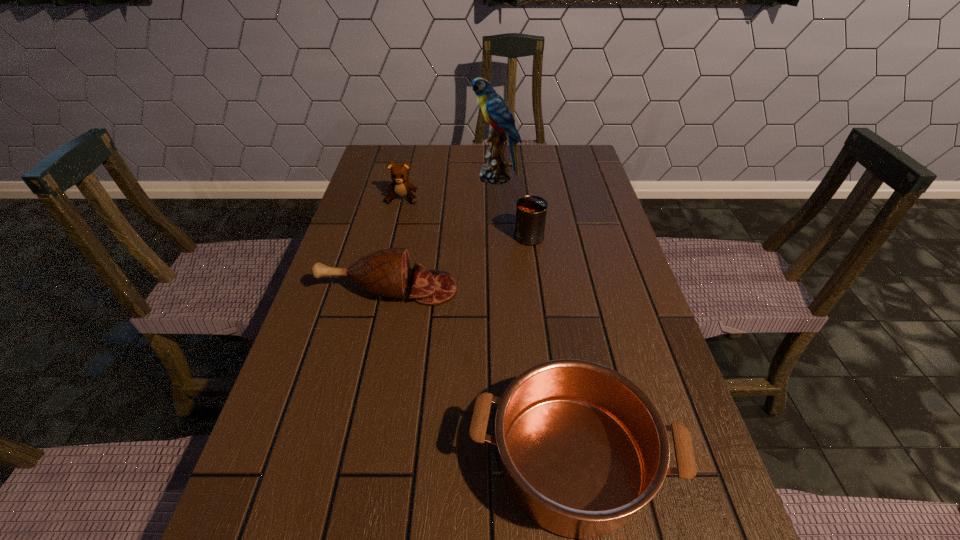
You are a GUI agent. You are given a task and a screenshot of the screen. Output one action in this format:
    pyautogui.click(x=<x>, y=<y>)
    Task: Click on the free space between the tallest object and the fourth nearest object
    
    Given the screenshot: What is the action you would take?
    pyautogui.click(x=449, y=188)

The height and width of the screenshot is (540, 960). In order to click on free space between the fourth farthest object and the fourth shortest object in this screenshot , I will do `click(459, 263)`.

Where is `empty space between the ham and the fourth nearest object`? The width and height of the screenshot is (960, 540). empty space between the ham and the fourth nearest object is located at coordinates (396, 244).

Identify which object is located as the fourth nearest to the farthest object. Please provide its 2D coordinates. Your answer should be formatted as a tuple, i.e. [(x, y)], where the tuple contains the x and y coordinates of a point satisfying the conditions above.

[(582, 448)]

Locate which object ranks fourth in proximity to the ham. Please provide its 2D coordinates. Your answer should be formatted as a tuple, i.e. [(x, y)], where the tuple contains the x and y coordinates of a point satisfying the conditions above.

[(494, 109)]

Where is `free space that satisfies the following two spatial constraints: 1. on the back side of the can; 2. on the face of the tallest object`? This screenshot has height=540, width=960. free space that satisfies the following two spatial constraints: 1. on the back side of the can; 2. on the face of the tallest object is located at coordinates (521, 177).